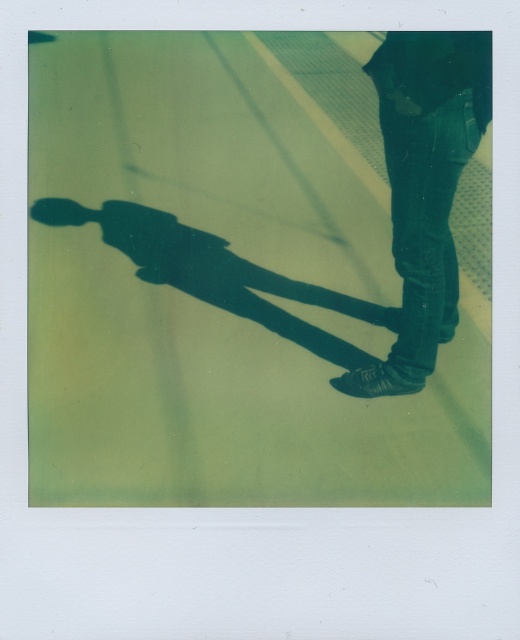
Between point (312, 310) and point (391, 141), which one is positioned in front?

Point (391, 141) is in front.

Consider the image. Who is higher up, green polished concrete at center or jeans at right?

green polished concrete at center

Between point (35, 400) and point (461, 88), which one is positioned in front?

Point (461, 88) is in front.

The image size is (520, 640). I want to click on green polished concrete at center, so click(x=247, y=273).